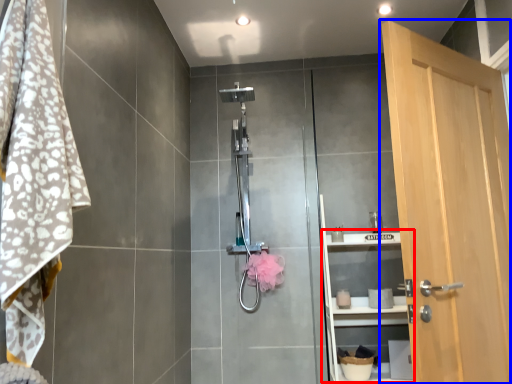
Question: Which object appears closest to the camera in this image, shelf (highlighted by a red box) or door (highlighted by a blue box)?

Choices:
 (A) shelf
 (B) door

Answer: (B)